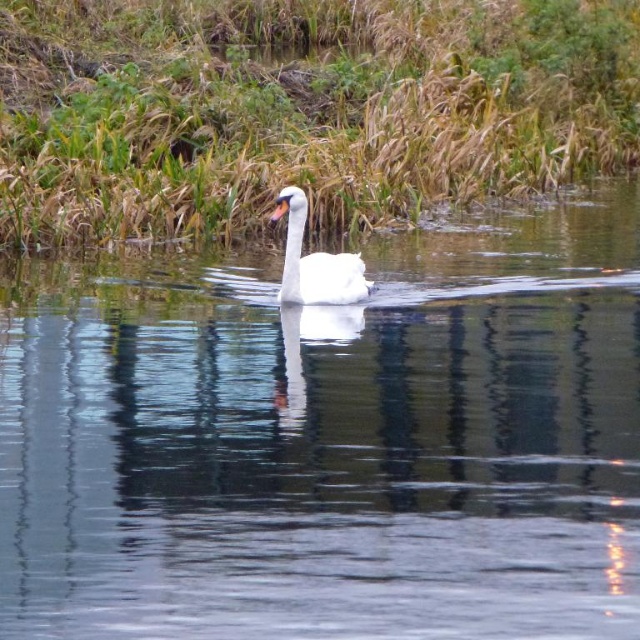
Which is below, clear water at center or white glossy swan at center?

clear water at center

What do you see at coordinates (330, 436) in the screenshot?
I see `clear water at center` at bounding box center [330, 436].

Locate an element on the screen. clear water at center is located at coordinates pos(330,436).

Based on the photo, does clear water at center have a lesser height compared to green grass at center?

Indeed, clear water at center has a lesser height compared to green grass at center.

Is point (262, 504) in front of point (522, 170)?

That is True.

Locate an element on the screen. Image resolution: width=640 pixels, height=640 pixels. clear water at center is located at coordinates (330, 436).

Is green grass at center closer to camera compared to white glossy swan at center?

No, it is behind white glossy swan at center.

Which is behind, point (198, 40) or point (324, 269)?

The point (198, 40) is behind.

Identify the location of green grass at center. This screenshot has height=640, width=640. (300, 109).